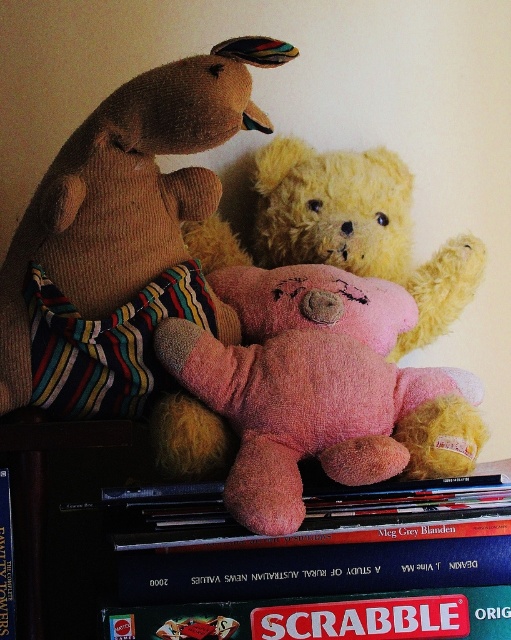
You are standing 30 inches away from the dark wooden surface. You want to place a small toy at the point marked as point (200, 490). Is the point within your reach?

The distance of point (200, 490) from viewer is 28.69 inches, so yes, the point is within reach since it is closer than 30 inches.

You are organizing a display of stuffed animals on a shelf. You have a soft pink plush at upper center and a fluffy pink teddy bear at center. Which stuffed animal is positioned to the left of the other?

The soft pink plush at upper center is to the left of the fluffy pink teddy bear at center.